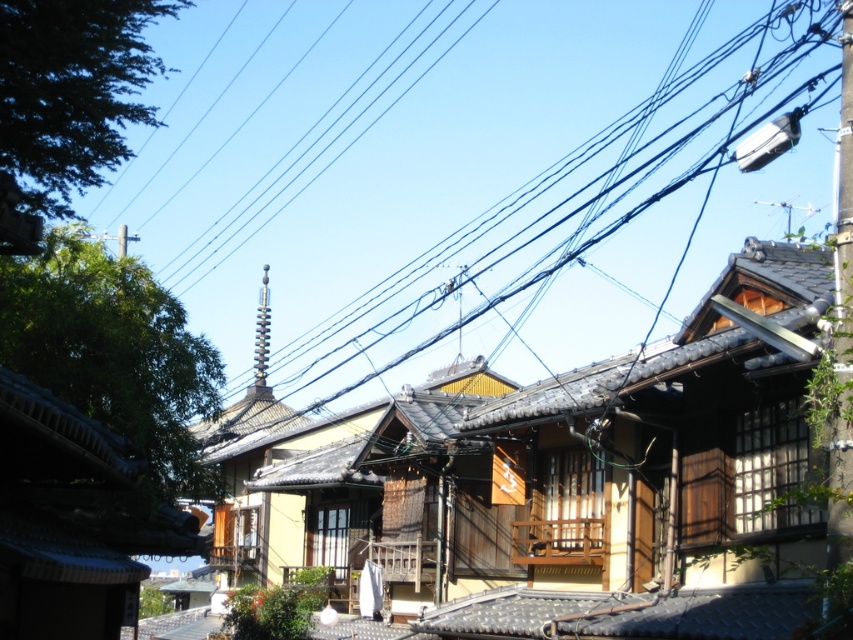
Question: Is black wire at upper center to the left of metallic pole at upper right from the viewer's perspective?

Choices:
 (A) yes
 (B) no

Answer: (A)

Question: Which point is closer to the camera?

Choices:
 (A) metallic pole at upper right
 (B) black wire at upper center

Answer: (A)

Question: Can you confirm if black wire at upper center is positioned to the left of metallic pole at upper right?

Choices:
 (A) no
 (B) yes

Answer: (B)

Question: Is black wire at upper center thinner than metallic pole at upper right?

Choices:
 (A) yes
 (B) no

Answer: (B)